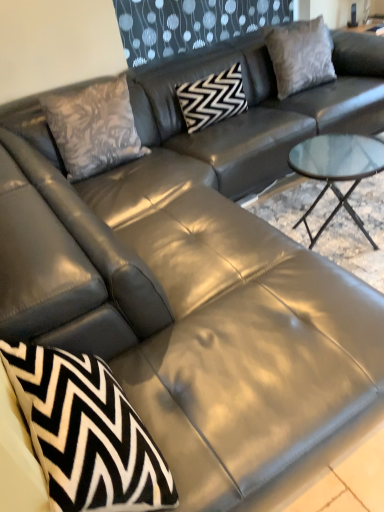
Question: Is floral-patterned fabric pillow at upper left, the first throw pillow viewed from the back, closer to camera compared to black zigzag-patterned pillow at center, which ranks as the 2th pillow in right-to-left order?

Choices:
 (A) yes
 (B) no

Answer: (A)

Question: Does floral-patterned fabric pillow at upper left, which ranks as the 1th throw pillow in top-to-bottom order, have a larger size compared to black zigzag-patterned pillow at center, which ranks as the 2th pillow in right-to-left order?

Choices:
 (A) no
 (B) yes

Answer: (B)

Question: Considering the relative sizes of floral-patterned fabric pillow at upper left, which ranks as the 1th throw pillow in top-to-bottom order, and black zigzag-patterned pillow at center, arranged as the 1th pillow when viewed from the left, in the image provided, is floral-patterned fabric pillow at upper left, which ranks as the 1th throw pillow in top-to-bottom order, smaller than black zigzag-patterned pillow at center, arranged as the 1th pillow when viewed from the left,?

Choices:
 (A) no
 (B) yes

Answer: (A)

Question: From the image's perspective, does floral-patterned fabric pillow at upper left, the 2th throw pillow in the bottom-to-top sequence, appear lower than black zigzag-patterned pillow at center, arranged as the 1th pillow when viewed from the left?

Choices:
 (A) yes
 (B) no

Answer: (A)

Question: Is black zigzag-patterned pillow at center, which ranks as the 2th pillow in right-to-left order, a part of floral-patterned fabric pillow at upper left, which ranks as the 1th throw pillow in top-to-bottom order?

Choices:
 (A) no
 (B) yes

Answer: (A)

Question: Do you think suede gray pillow at upper right, the 1th pillow in the right-to-left sequence, is within black and white zigzag pillow at lower left, which ranks as the first throw pillow in front-to-back order, or outside of it?

Choices:
 (A) outside
 (B) inside

Answer: (A)

Question: In the image, is suede gray pillow at upper right, marked as the second pillow in a left-to-right arrangement, on the left side or the right side of black and white zigzag pillow at lower left, which appears as the 2th throw pillow when viewed from the back?

Choices:
 (A) right
 (B) left

Answer: (A)

Question: From the image's perspective, relative to black and white zigzag pillow at lower left, which is the first throw pillow in bottom-to-top order, is suede gray pillow at upper right, the 1th pillow in the right-to-left sequence, above or below?

Choices:
 (A) below
 (B) above

Answer: (B)

Question: Looking at the image, does suede gray pillow at upper right, marked as the second pillow in a left-to-right arrangement, seem bigger or smaller compared to black and white zigzag pillow at lower left, the second throw pillow from the top?

Choices:
 (A) small
 (B) big

Answer: (B)

Question: From a real-world perspective, is suede gray pillow at upper right, marked as the second pillow in a left-to-right arrangement, physically located above or below black zigzag-patterned pillow at center, which ranks as the 2th pillow in right-to-left order?

Choices:
 (A) below
 (B) above

Answer: (B)

Question: In the image, is suede gray pillow at upper right, marked as the second pillow in a left-to-right arrangement, positioned in front of or behind black zigzag-patterned pillow at center, arranged as the 1th pillow when viewed from the left?

Choices:
 (A) front
 (B) behind

Answer: (B)

Question: From the image's perspective, relative to black zigzag-patterned pillow at center, which ranks as the 2th pillow in right-to-left order, is suede gray pillow at upper right, marked as the second pillow in a left-to-right arrangement, above or below?

Choices:
 (A) above
 (B) below

Answer: (A)

Question: Is suede gray pillow at upper right, marked as the second pillow in a left-to-right arrangement, bigger or smaller than black zigzag-patterned pillow at center, which ranks as the 2th pillow in right-to-left order?

Choices:
 (A) big
 (B) small

Answer: (A)

Question: Considering the positions of black zigzag-patterned pillow at center, arranged as the 1th pillow when viewed from the left, and floral-patterned fabric pillow at upper left, which is the second throw pillow from front to back, in the image, is black zigzag-patterned pillow at center, arranged as the 1th pillow when viewed from the left, wider or thinner than floral-patterned fabric pillow at upper left, which is the second throw pillow from front to back,?

Choices:
 (A) thin
 (B) wide

Answer: (B)

Question: Is point (221, 118) closer or farther from the camera than point (117, 158)?

Choices:
 (A) farther
 (B) closer

Answer: (A)